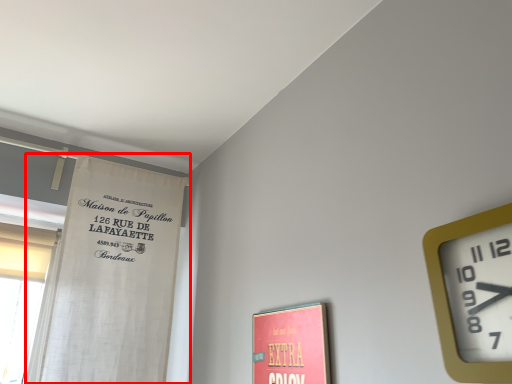
Question: From the image's perspective, what is the correct spatial positioning of curtain (annotated by the red box) in reference to wall clock?

Choices:
 (A) below
 (B) above

Answer: (A)